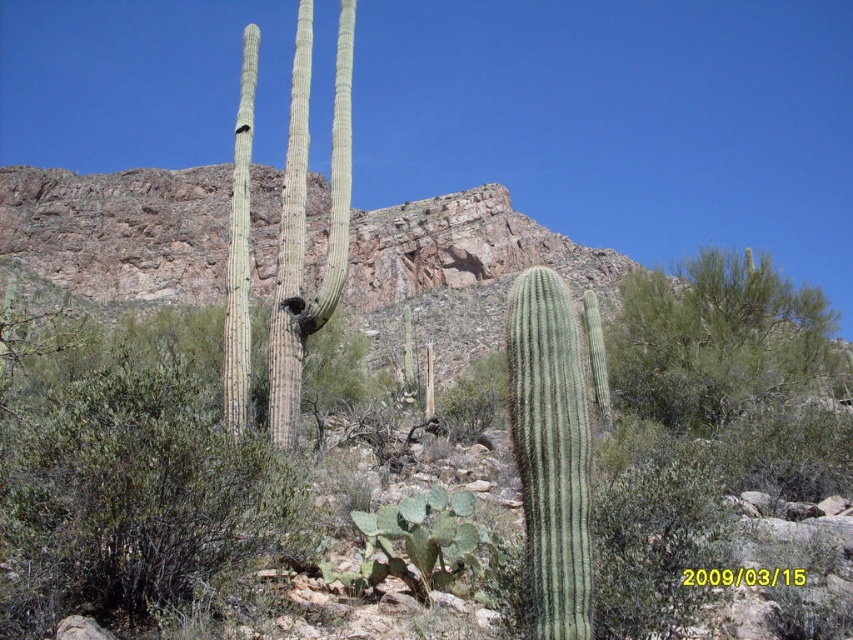
You are standing in the desert and see the green ribbed cactus at center and the green spiny cactus at lower center. Which cactus is positioned to the right of the other?

The green ribbed cactus at center is to the right of the green spiny cactus at lower center.

You are a desert explorer trying to navigate between the green ribbed cactus at center and the green spiny cactus at lower center. Which direction should you move to get closer to the one that is closer to you?

The green ribbed cactus at center is in front of the green spiny cactus at lower center, so it is closer to you. To get closer to the closer one, move toward the green ribbed cactus at center.